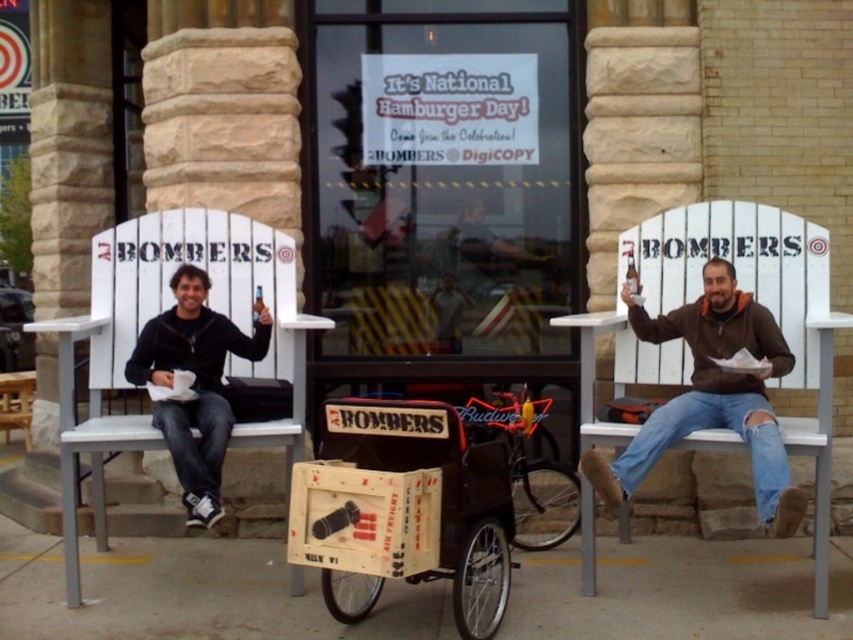
You are a photographer trying to capture a group photo of the two people wearing the brown fuzzy jacket at right and the black matte jacket at left. If you want to ensure both jackets are fully visible in the photo, which jacket requires more space horizontally?

The brown fuzzy jacket at right requires more horizontal space because its width surpasses that of the black matte jacket at left.